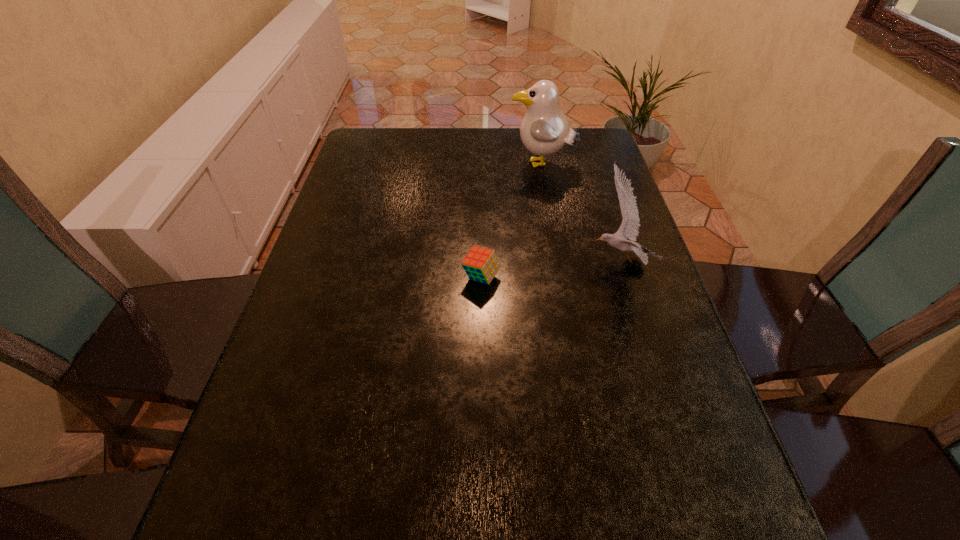
Where is `vacant area located at the tip of the beak of the shorter gull`? The image size is (960, 540). vacant area located at the tip of the beak of the shorter gull is located at coordinates (471, 261).

Locate an element on the screen. blank area located at the tip of the beak of the shorter gull is located at coordinates (505, 261).

The height and width of the screenshot is (540, 960). What are the coordinates of `vacant space situated on the front of the cube` in the screenshot? It's located at (481, 313).

Find the location of a particular element. This screenshot has height=540, width=960. object located in the far edge section of the desktop is located at coordinates (544, 130).

I want to click on object present at the far right corner, so click(x=544, y=130).

The image size is (960, 540). Find the location of `blank space at the left edge`. blank space at the left edge is located at coordinates (272, 404).

In the image, there is a desktop. Where is `vacant area at the right edge`? The image size is (960, 540). vacant area at the right edge is located at coordinates (606, 177).

Find the location of a particular element. vacant space at the far left corner of the desktop is located at coordinates (377, 145).

Where is `free space that is in between the farther gull and the cube`? The image size is (960, 540). free space that is in between the farther gull and the cube is located at coordinates (512, 221).

Identify the location of vacant space that's between the tallest object and the shortest object. (512, 221).